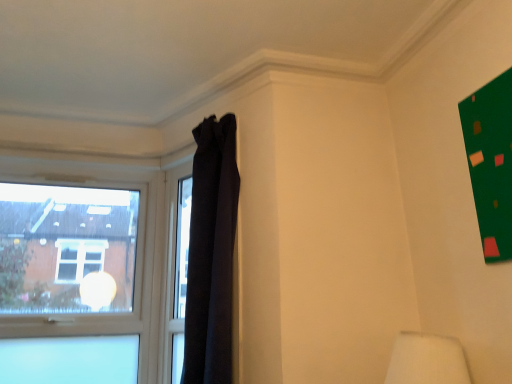
Question: Is black fabric curtain at upper center in front of or behind transparent glass window at left in the image?

Choices:
 (A) behind
 (B) front

Answer: (B)

Question: From the image's perspective, is black fabric curtain at upper center above or below transparent glass window at left?

Choices:
 (A) above
 (B) below

Answer: (A)

Question: From a real-world perspective, is black fabric curtain at upper center physically located above or below transparent glass window at left?

Choices:
 (A) above
 (B) below

Answer: (A)

Question: From a real-world perspective, relative to black fabric curtain at upper center, is transparent glass window at left vertically above or below?

Choices:
 (A) above
 (B) below

Answer: (B)

Question: Based on their positions, is transparent glass window at left located to the left or right of black fabric curtain at upper center?

Choices:
 (A) right
 (B) left

Answer: (B)

Question: In terms of width, does transparent glass window at left look wider or thinner when compared to black fabric curtain at upper center?

Choices:
 (A) thin
 (B) wide

Answer: (A)

Question: Does point (81, 375) appear closer or farther from the camera than point (220, 304)?

Choices:
 (A) closer
 (B) farther

Answer: (B)